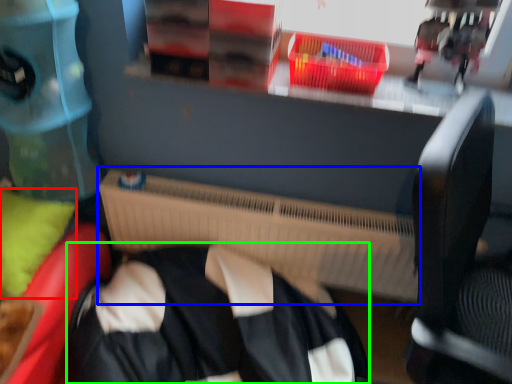
Question: Estimate the real-world distances between objects in this image. Which object is farther from pillow (highlighted by a red box), radiator (highlighted by a blue box) or clothing (highlighted by a green box)?

Choices:
 (A) radiator
 (B) clothing

Answer: (A)